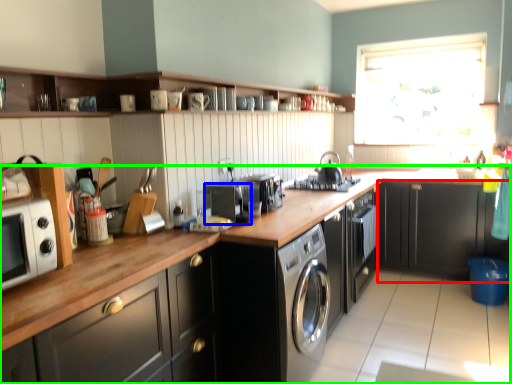
Question: Which is nearer to the cabinetry (highlighted by a red box)? appliance (highlighted by a blue box) or countertop (highlighted by a green box).

Choices:
 (A) appliance
 (B) countertop

Answer: (B)